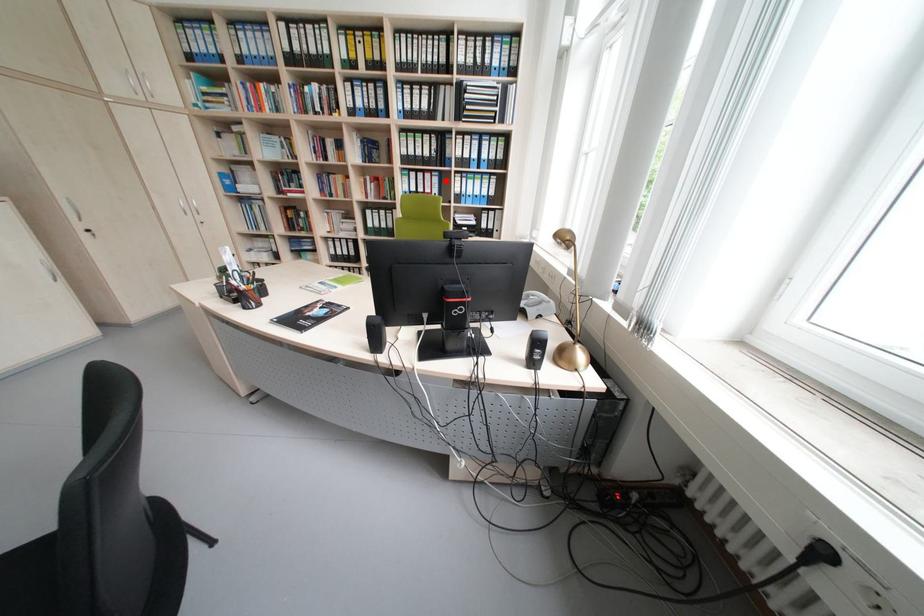
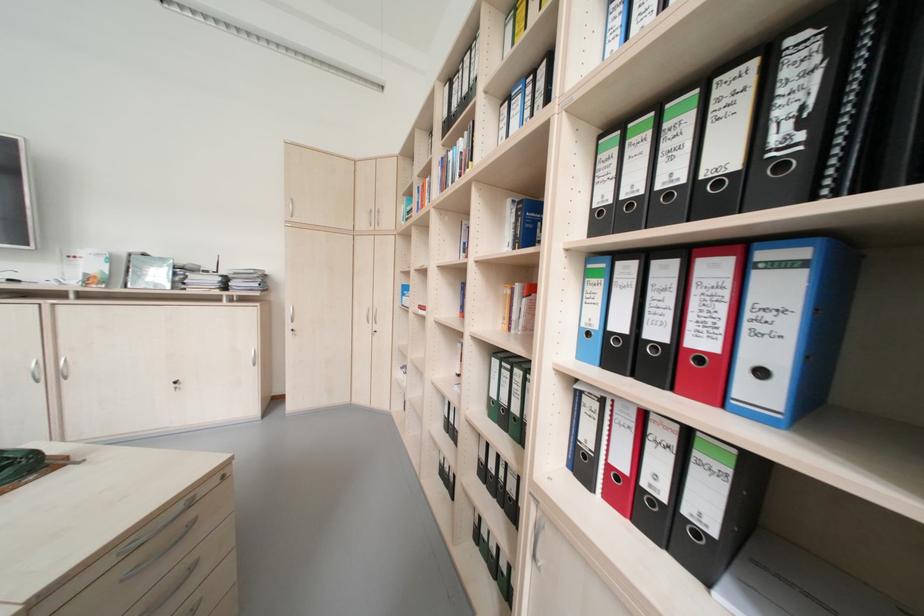
Find the pixel in the second image that matches the highlighted location in the first image.

(793, 290)